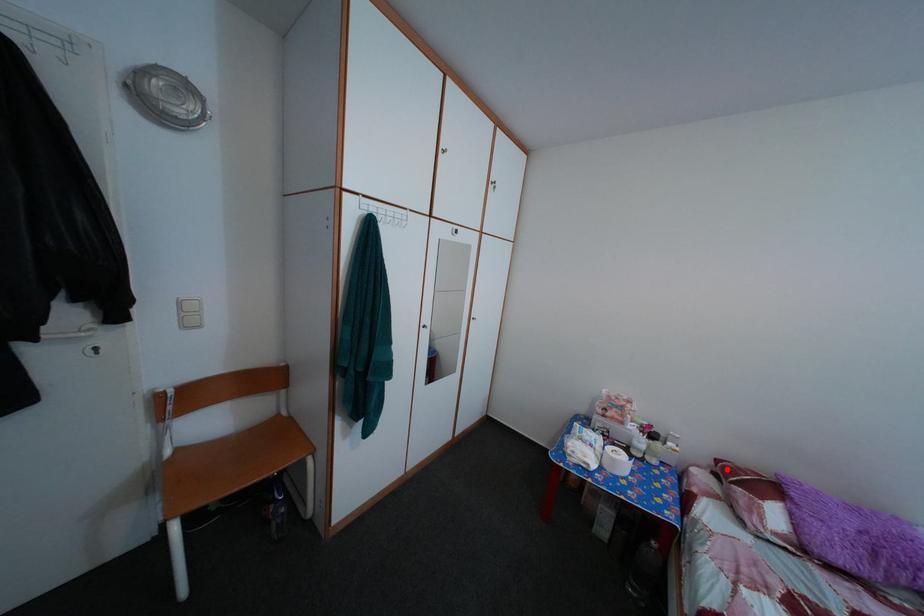
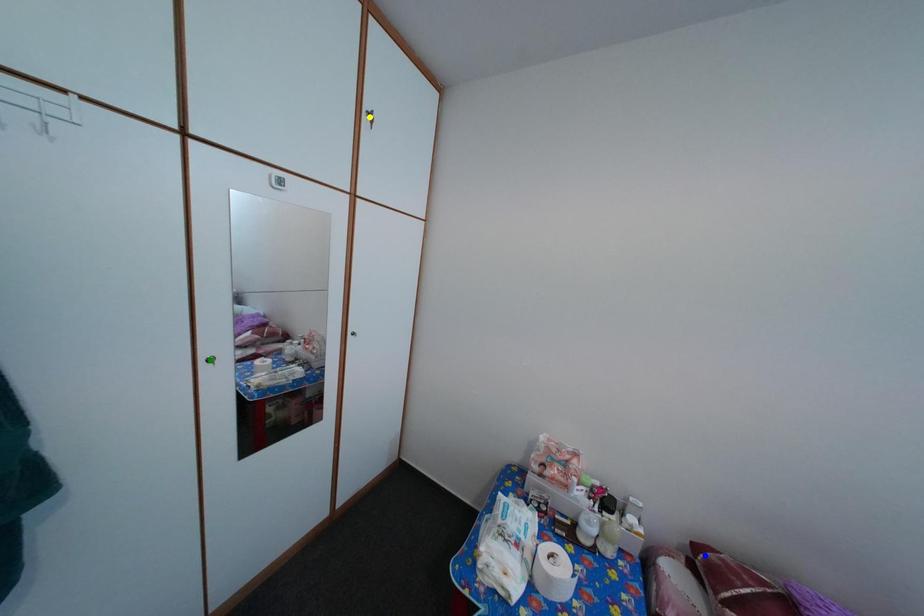
Question: I am providing you with two images of the same scene from different viewpoints. A red point is marked on the first image. You are given multiple points on the second image. Which point in image 2 represents the same 3d spot as the red point in image 1?

Choices:
 (A) green point
 (B) yellow point
 (C) blue point

Answer: (C)